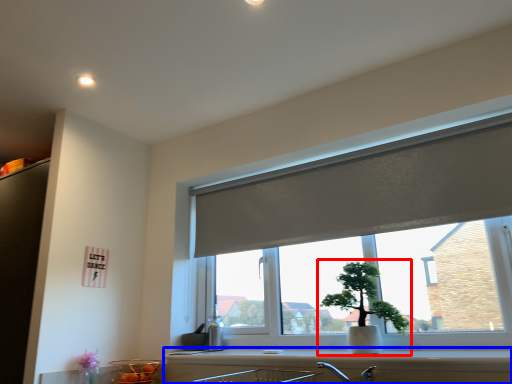
Question: Which object is closer to the camera taking this photo, houseplant (highlighted by a red box) or counter top (highlighted by a blue box)?

Choices:
 (A) houseplant
 (B) counter top

Answer: (B)